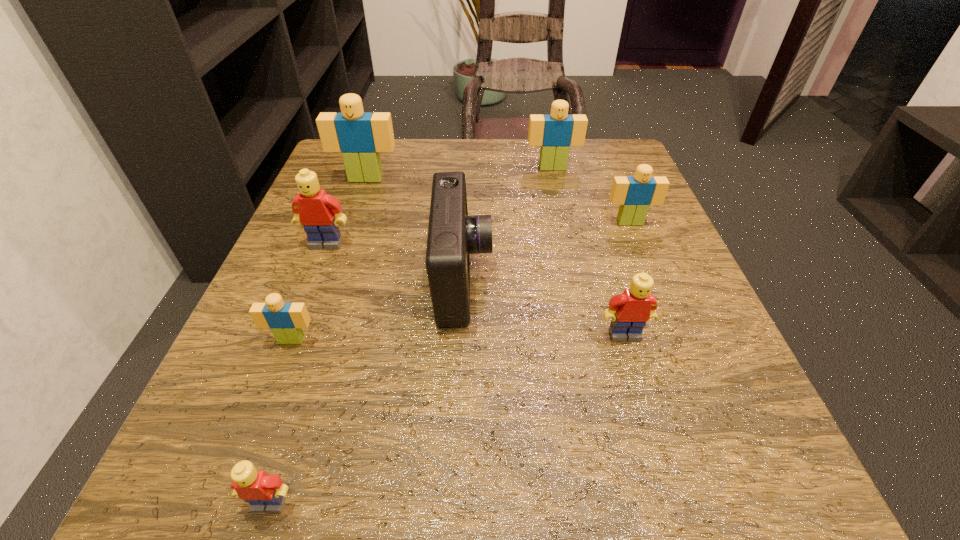
Locate an element on the screen. The image size is (960, 540). the second farthest yellow Lego is located at coordinates (636, 306).

Where is `the second smallest yellow Lego`? the second smallest yellow Lego is located at coordinates (x=636, y=306).

Find the location of a particular element. This screenshot has height=540, width=960. the smallest beige Lego is located at coordinates (286, 320).

Locate an element on the screen. The width and height of the screenshot is (960, 540). the nearest yellow Lego is located at coordinates (265, 493).

The width and height of the screenshot is (960, 540). I want to click on the nearest object, so click(265, 493).

The height and width of the screenshot is (540, 960). Identify the location of free space located 0.150m on the face of the seventh nearest object. (349, 227).

Find the location of a particular element. The width and height of the screenshot is (960, 540). free spot located 0.060m on the face of the third beige Lego from left to right is located at coordinates (557, 186).

Identify the location of vacant point located on the front-facing side of the fourth farthest Lego. (297, 319).

The width and height of the screenshot is (960, 540). I want to click on vacant area situated 0.120m on the front-facing side of the blue camera, so 564,280.

Locate an element on the screen. Image resolution: width=960 pixels, height=540 pixels. vacant area situated on the face of the third farthest object is located at coordinates (654, 282).